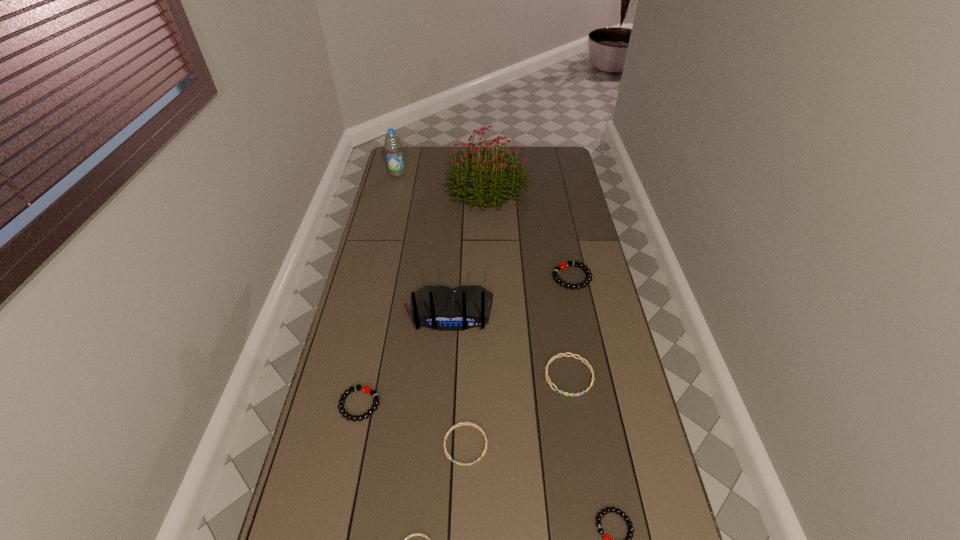
Image resolution: width=960 pixels, height=540 pixels. What are the coordinates of `bouquet` in the screenshot? It's located at (502, 183).

Locate an element on the screen. green bouquet is located at coordinates (502, 183).

Identify the location of blue water bottle. This screenshot has height=540, width=960. (393, 145).

The image size is (960, 540). What are the coordinates of `water bottle` in the screenshot? It's located at (393, 145).

Identify the location of black router. Image resolution: width=960 pixels, height=540 pixels. (439, 307).

Find the location of a particular element. This screenshot has width=960, height=540. the fourth farthest object is located at coordinates [439, 307].

The width and height of the screenshot is (960, 540). What are the coordinates of `the third farthest object` in the screenshot? It's located at (563, 265).

At what (x,y) coordinates should I click in order to perform the action: click on the farthest bracelet. Please return your answer as a coordinate pair (x, y). This screenshot has width=960, height=540. Looking at the image, I should click on (563, 265).

This screenshot has width=960, height=540. I want to click on the biggest blue bracelet, so pyautogui.click(x=550, y=383).

This screenshot has height=540, width=960. In order to click on the rightmost blue bracelet in this screenshot , I will do `click(550, 383)`.